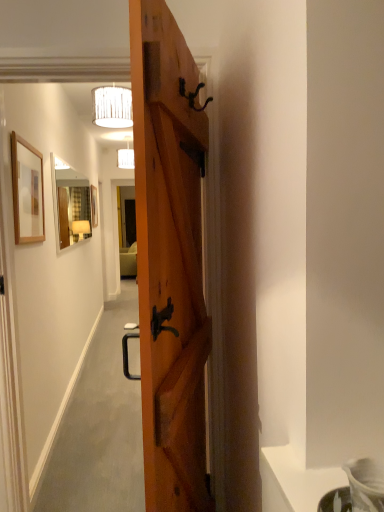
Question: From a real-world perspective, is wooden picture frame at upper left, which is the 1th picture frame from right to left, positioned over matte wooden mirror at upper center based on gravity?

Choices:
 (A) yes
 (B) no

Answer: (A)

Question: Does wooden picture frame at upper left, which is the 1th picture frame from right to left, come behind matte wooden mirror at upper center?

Choices:
 (A) no
 (B) yes

Answer: (A)

Question: Does wooden picture frame at upper left, the 1th picture frame positioned from the front, appear on the left side of matte wooden mirror at upper center?

Choices:
 (A) no
 (B) yes

Answer: (A)

Question: From the image's perspective, does wooden picture frame at upper left, placed as the 2th picture frame when sorted from left to right, appear higher than matte wooden mirror at upper center?

Choices:
 (A) no
 (B) yes

Answer: (A)

Question: Is wooden picture frame at upper left, which is the 1th picture frame from right to left, wider than matte wooden mirror at upper center?

Choices:
 (A) yes
 (B) no

Answer: (A)

Question: Is matte white lampshade at upper center, placed as the 2th lamp when sorted from right to left, taller or shorter than wooden door at center?

Choices:
 (A) tall
 (B) short

Answer: (B)

Question: In the image, is matte white lampshade at upper center, the 1th lamp viewed from the back, on the left side or the right side of wooden door at center?

Choices:
 (A) right
 (B) left

Answer: (B)

Question: From a real-world perspective, is matte white lampshade at upper center, acting as the second lamp starting from the front, above or below wooden door at center?

Choices:
 (A) above
 (B) below

Answer: (A)

Question: From the image's perspective, is matte white lampshade at upper center, placed as the 2th lamp when sorted from right to left, above or below wooden door at center?

Choices:
 (A) above
 (B) below

Answer: (A)

Question: Is matte white lampshade at upper center, the 1th lamp viewed from the back, wider or thinner than wooden picture frame at center, placed as the first picture frame when sorted from back to front?

Choices:
 (A) thin
 (B) wide

Answer: (B)

Question: Would you say matte white lampshade at upper center, placed as the 2th lamp when sorted from right to left, is to the left or to the right of wooden picture frame at center, placed as the first picture frame when sorted from back to front, in the picture?

Choices:
 (A) left
 (B) right

Answer: (B)

Question: From the image's perspective, is matte white lampshade at upper center, the 1th lamp viewed from the back, positioned above or below wooden picture frame at center, acting as the 2th picture frame starting from the right?

Choices:
 (A) below
 (B) above

Answer: (B)

Question: Is matte white lampshade at upper center, the 1th lamp viewed from the back, in front of or behind wooden picture frame at center, placed as the first picture frame when sorted from back to front, in the image?

Choices:
 (A) front
 (B) behind

Answer: (B)

Question: Relative to wooden picture frame at upper left, the 1th picture frame positioned from the front, is white fabric lampshade at upper center, which is counted as the 1th lamp, starting from the front, in front or behind?

Choices:
 (A) behind
 (B) front

Answer: (A)

Question: Is white fabric lampshade at upper center, the second lamp when ordered from left to right, bigger or smaller than wooden picture frame at upper left, placed as the 2th picture frame when sorted from back to front?

Choices:
 (A) small
 (B) big

Answer: (B)